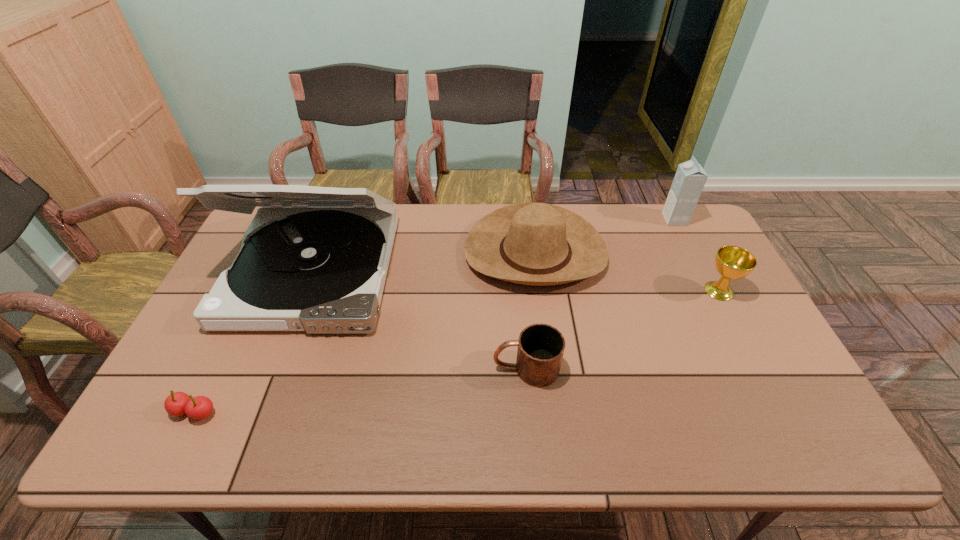
Image resolution: width=960 pixels, height=540 pixels. I want to click on free spot at the right edge of the desktop, so click(x=707, y=247).

Find the location of a particular element. This screenshot has height=540, width=960. unoccupied position between the second tallest object and the cowboy hat is located at coordinates (605, 237).

Where is `vacant area between the CD player and the cowboy hat`? The width and height of the screenshot is (960, 540). vacant area between the CD player and the cowboy hat is located at coordinates (424, 262).

Where is `free space between the fifth tallest object and the tallest object`? The width and height of the screenshot is (960, 540). free space between the fifth tallest object and the tallest object is located at coordinates (420, 320).

You are a GUI agent. You are given a task and a screenshot of the screen. Output one action in this format:
    pyautogui.click(x=<x>, y=<y>)
    Task: Click on the empty location between the tallest object and the third tallest object
    
    Given the screenshot: What is the action you would take?
    pyautogui.click(x=424, y=262)

You are a GUI agent. You are given a task and a screenshot of the screen. Output one action in this format:
    pyautogui.click(x=<x>, y=<y>)
    Task: Click on the free space between the second tallest object and the second shortest object
    This screenshot has height=540, width=960.
    Given the screenshot: What is the action you would take?
    pyautogui.click(x=600, y=294)

Image resolution: width=960 pixels, height=540 pixels. In order to click on free space between the chalice and the cowboy hat in this screenshot , I will do `click(627, 272)`.

Where is `empty location between the CD player and the nearest object`? The height and width of the screenshot is (540, 960). empty location between the CD player and the nearest object is located at coordinates (253, 341).

Identify the location of free point between the fourth shortest object and the fourth tallest object. click(627, 272).

Identify the location of free space between the tallest object and the nearest object. (253, 341).